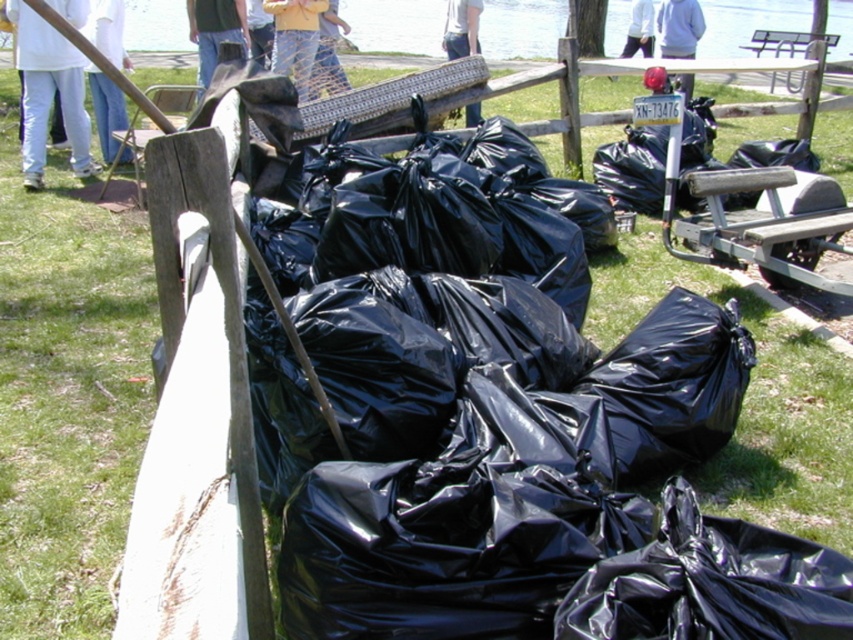
You are standing at the center of the image and want to walk towards the white cotton pants at left. In which general direction should you move?

You should move towards the left direction to reach the white cotton pants at left since it is located at the left side of the image.